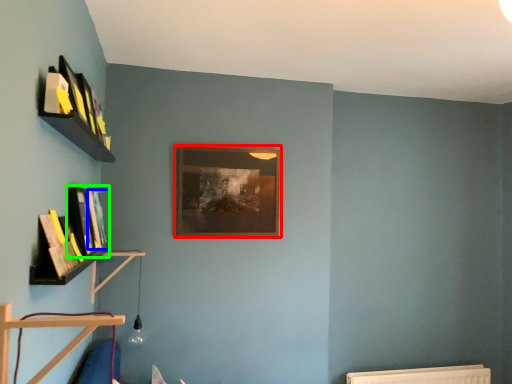
Question: Which object is positioned closest to picture frame (highlighted by a red box)? Select from book (highlighted by a blue box) and book (highlighted by a green box).

Choices:
 (A) book
 (B) book

Answer: (A)